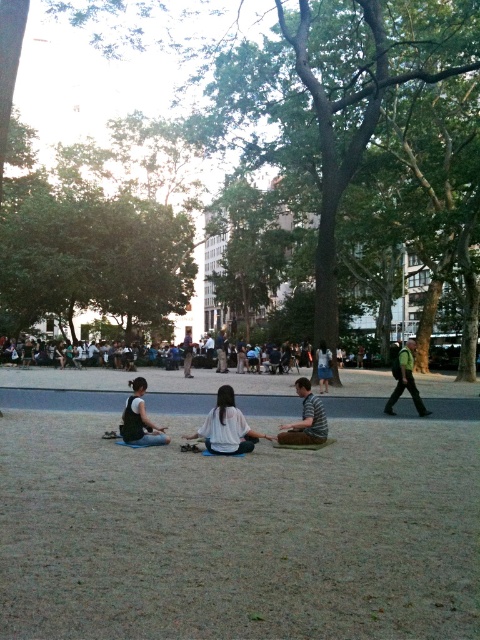
Does green leafy tree at center lie behind green fabric pants at lower right?

No, it is not.

Is green leafy tree at center smaller than green fabric pants at lower right?

No.

Between point (73, 22) and point (396, 372), which one is positioned in front?

Positioned in front is point (396, 372).

Locate an element on the screen. green leafy tree at center is located at coordinates (356, 128).

Is green leafy tree at center above matte black vest at center?

Yes, green leafy tree at center is above matte black vest at center.

Does green leafy tree at center have a lesser height compared to matte black vest at center?

No, green leafy tree at center is not shorter than matte black vest at center.

Does point (325, 118) come behind point (137, 387)?

Yes, point (325, 118) is behind point (137, 387).

Identify the location of green leafy tree at center. (356, 128).

Can you confirm if matte black vest at center is taller than denim pants at center?

No.

Does matte black vest at center appear under denim pants at center?

Yes, matte black vest at center is below denim pants at center.

Where is `matte black vest at center`? Image resolution: width=480 pixels, height=640 pixels. matte black vest at center is located at coordinates (140, 419).